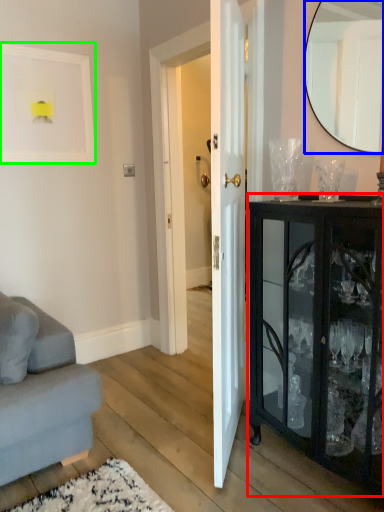
Question: Which object is the farthest from cabinetry (highlighted by a red box)? Choose among these: mirror (highlighted by a blue box) or picture frame (highlighted by a green box).

Choices:
 (A) mirror
 (B) picture frame

Answer: (B)